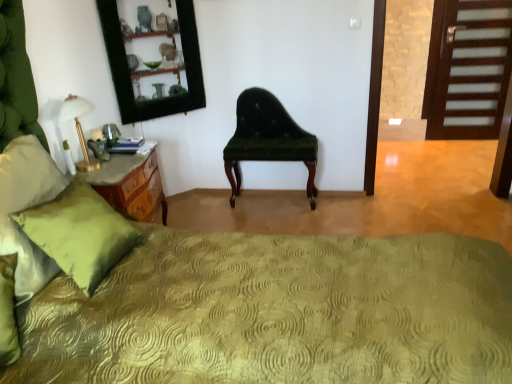
Where is `green polished wood nightstand at left`? green polished wood nightstand at left is located at coordinates (137, 191).

In the scene shown: Measure the distance between dark wood door at right and camera.

The distance of dark wood door at right from camera is 3.66 meters.

Find the location of `green textured pillow at left`. green textured pillow at left is located at coordinates (80, 233).

This screenshot has height=384, width=512. What are the coordinates of `green polished wood nightstand at left` in the screenshot? It's located at (137, 191).

From the picture: Is dark wood door at right at the left side of green textured bedspread at center?

Incorrect, dark wood door at right is not on the left side of green textured bedspread at center.

From a real-world perspective, is dark wood door at right located beneath green textured bedspread at center?

Yes, from a real-world perspective, dark wood door at right is beneath green textured bedspread at center.

Which object is more forward, dark wood door at right or green textured bedspread at center?

green textured bedspread at center is more forward.

From the image's perspective, is green polished wood nightstand at left positioned above or below green glass mirror at upper left?

Based on their image positions, green polished wood nightstand at left is located beneath green glass mirror at upper left.

Does point (144, 209) appear closer or farther from the camera than point (136, 17)?

Point (144, 209) appears to be closer to the viewer than point (136, 17).

Consider the image. Would you consider green polished wood nightstand at left to be distant from green glass mirror at upper left?

No, green polished wood nightstand at left is not far from green glass mirror at upper left.

How much distance is there between green polished wood nightstand at left and green glass mirror at upper left?

green polished wood nightstand at left and green glass mirror at upper left are 73.34 centimeters apart from each other.

Is point (304, 243) positioned after point (79, 200)?

Yes, point (304, 243) is behind point (79, 200).

Consider the image. Considering the positions of objects green textured bedspread at center and green textured pillow at left in the image provided, who is more to the left, green textured bedspread at center or green textured pillow at left?

From the viewer's perspective, green textured pillow at left appears more on the left side.

Is green textured bedspread at center positioned with its back to green textured pillow at left?

Yes.

Considering the sizes of objects green textured bedspread at center and green textured pillow at left in the image provided, who is smaller, green textured bedspread at center or green textured pillow at left?

Smaller between the two is green textured pillow at left.

Is green textured pillow at left wider than green textured bedspread at center?

In fact, green textured pillow at left might be narrower than green textured bedspread at center.

Between green textured pillow at left and green textured bedspread at center, which one appears on the right side from the viewer's perspective?

green textured bedspread at center.

From the image's perspective, is green textured pillow at left located beneath green textured bedspread at center?

Incorrect, from the image's perspective, green textured pillow at left is higher than green textured bedspread at center.

Is green textured pillow at left inside the boundaries of green textured bedspread at center, or outside?

green textured pillow at left lies within the bounds of green textured bedspread at center.

Is white glass table lamp at left inside green polished wood nightstand at left?

Actually, white glass table lamp at left is outside green polished wood nightstand at left.

Which is behind, point (140, 200) or point (79, 168)?

Positioned behind is point (140, 200).

Looking at this image, is green polished wood nightstand at left directly adjacent to white glass table lamp at left?

green polished wood nightstand at left and white glass table lamp at left are not in contact.

Which object is further away from the camera taking this photo, green polished wood nightstand at left or white glass table lamp at left?

green polished wood nightstand at left is further away from the camera.

Is green textured bedspread at center oriented away from white glass table lamp at left?

No, white glass table lamp at left is not at the back of green textured bedspread at center.

Is white glass table lamp at left a part of green textured bedspread at center?

No.

The width and height of the screenshot is (512, 384). What are the coordinates of `bed on the right of the white glass table lamp at left` in the screenshot? It's located at (298, 287).

Which of these two, white glass table lamp at left or green textured pillow at left, stands taller?

green textured pillow at left.

Does white glass table lamp at left touch green textured pillow at left?

white glass table lamp at left and green textured pillow at left are not in contact.

Which object is positioned more to the left, white glass table lamp at left or green textured pillow at left?

Positioned to the left is white glass table lamp at left.

Is white glass table lamp at left behind green textured pillow at left?

That is True.

Locate an element on the screen. The width and height of the screenshot is (512, 384). door on the right of the green textured bedspread at center is located at coordinates (468, 69).

Locate an element on the screen. The image size is (512, 384). mirror behind the green polished wood nightstand at left is located at coordinates (152, 58).

Which object lies further to the anchor point green textured pillow at left, green polished wood nightstand at left or green glass mirror at upper left?

The object further to green textured pillow at left is green glass mirror at upper left.

From the image, which object appears to be farther from green textured pillow at left, green polished wood nightstand at left or white glass table lamp at left?

The object further to green textured pillow at left is white glass table lamp at left.

Considering their positions, is green textured pillow at left positioned further to white glass table lamp at left than dark wood door at right?

Based on the image, dark wood door at right appears to be further to white glass table lamp at left.

Which object lies nearer to the anchor point white glass table lamp at left, green polished wood nightstand at left or dark wood door at right?

Based on the image, green polished wood nightstand at left appears to be nearer to white glass table lamp at left.

Looking at the image, which one is located closer to white glass table lamp at left, velvet green chair at center or green polished wood nightstand at left?

Based on the image, green polished wood nightstand at left appears to be nearer to white glass table lamp at left.

Estimate the real-world distances between objects in this image. Which object is further from velvet green chair at center, green textured bedspread at center or white glass table lamp at left?

green textured bedspread at center is positioned further to the anchor velvet green chair at center.

Considering their positions, is green textured pillow at left positioned further to dark wood door at right than green glass mirror at upper left?

green textured pillow at left is positioned further to the anchor dark wood door at right.

Estimate the real-world distances between objects in this image. Which object is further from green textured bedspread at center, green glass mirror at upper left or green polished wood nightstand at left?

Based on the image, green glass mirror at upper left appears to be further to green textured bedspread at center.

I want to click on chair situated between green glass mirror at upper left and dark wood door at right from left to right, so click(x=267, y=139).

The height and width of the screenshot is (384, 512). I want to click on table lamp between green textured bedspread at center and velvet green chair at center from front to back, so click(x=78, y=128).

What are the coordinates of `table lamp between green glass mirror at upper left and green polished wood nightstand at left in the vertical direction` in the screenshot? It's located at (78, 128).

Identify the location of nightstand between green textured bedspread at center and dark wood door at right from front to back. The width and height of the screenshot is (512, 384). (137, 191).